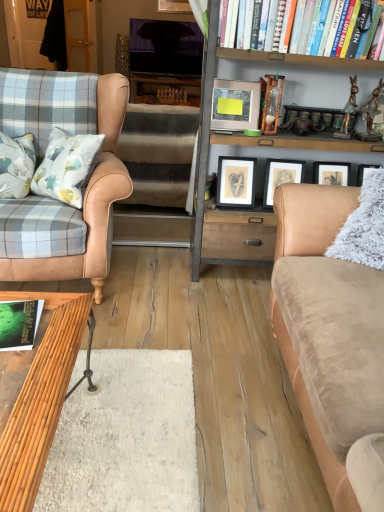
Question: Looking at the image, does green matte book at lower left, which ranks as the first book in left-to-right order, seem bigger or smaller compared to matte silver picture frame at center, acting as the 2th picture frame starting from the back?

Choices:
 (A) big
 (B) small

Answer: (B)

Question: From a real-world perspective, is green matte book at lower left, the 1th book positioned from the bottom, above or below matte silver picture frame at center, the second picture frame when ordered from top to bottom?

Choices:
 (A) below
 (B) above

Answer: (A)

Question: Which of these objects is positioned farthest from the tan leather chair at left?

Choices:
 (A) green matte book at lower left, which appears as the second book when viewed from the back
 (B) matte silver picture frame at center, positioned as the 2th picture frame in left-to-right order
 (C) matte silver picture frame at upper center, the 1th picture frame positioned from the back
 (D) tan suede studio couch at right
 (E) satin wood bookcase at center

Answer: (C)

Question: Estimate the real-world distances between objects in this image. Which object is farther from the tan suede studio couch at right?

Choices:
 (A) tan leather chair at left
 (B) hardcover book at upper right, the 1th book viewed from the right
 (C) green matte book at lower left, marked as the second book in a top-to-bottom arrangement
 (D) brown plush stair at center
 (E) satin wood bookcase at center

Answer: (D)